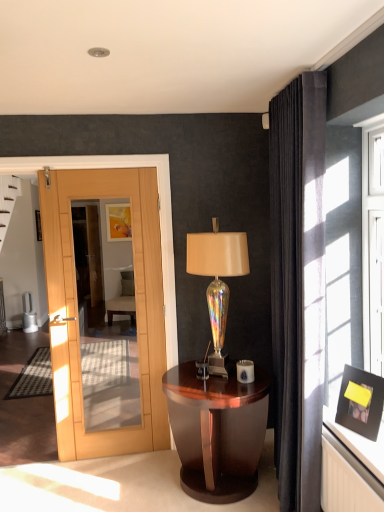
This screenshot has height=512, width=384. What do you see at coordinates (360, 402) in the screenshot?
I see `matte black picture frame at upper right, the second picture frame from the top` at bounding box center [360, 402].

Image resolution: width=384 pixels, height=512 pixels. I want to click on iridescent glass table lamp at center, so click(217, 279).

Based on the photo, is the depth of glossy wood nightstand at center less than that of matte gold picture frame at upper center, the 2th picture frame viewed from the right?

That is True.

Image resolution: width=384 pixels, height=512 pixels. Identify the location of nightstand below the matte gold picture frame at upper center, which is the first picture frame from back to front (from the image's perspective). (217, 431).

From the image's perspective, which one is positioned lower, glossy wood nightstand at center or matte gold picture frame at upper center, which is the first picture frame from back to front?

glossy wood nightstand at center, from the image's perspective.

Considering the relative sizes of glossy wood nightstand at center and matte gold picture frame at upper center, the second picture frame when ordered from front to back, in the image provided, is glossy wood nightstand at center thinner than matte gold picture frame at upper center, the second picture frame when ordered from front to back,?

No, glossy wood nightstand at center is not thinner than matte gold picture frame at upper center, the second picture frame when ordered from front to back.

Is velvet dark gray curtain at right next to glossy wood nightstand at center?

They are not placed beside each other.

Is point (289, 329) less distant than point (263, 410)?

Yes.

Can glossy wood nightstand at center be found inside velvet dark gray curtain at right?

No, glossy wood nightstand at center is not a part of velvet dark gray curtain at right.

Does matte black picture frame at upper right, which is the 1th picture frame in right-to-left order, touch iridescent glass table lamp at center?

matte black picture frame at upper right, which is the 1th picture frame in right-to-left order, is not next to iridescent glass table lamp at center, and they're not touching.

In the scene shown: From a real-world perspective, is matte black picture frame at upper right, the second picture frame from the top, below iridescent glass table lamp at center?

Indeed, from a real-world perspective, matte black picture frame at upper right, the second picture frame from the top, is positioned beneath iridescent glass table lamp at center.

Considering the points (349, 414) and (229, 241), which point is in front, point (349, 414) or point (229, 241)?

Point (349, 414)

Is matte black picture frame at upper right, which appears as the 1th picture frame when viewed from the front, not within iridescent glass table lamp at center?

Yes, matte black picture frame at upper right, which appears as the 1th picture frame when viewed from the front, is outside of iridescent glass table lamp at center.

Does point (346, 374) lie in front of point (290, 465)?

Yes, it is in front of point (290, 465).

Considering the relative sizes of matte black picture frame at upper right, which appears as the 1th picture frame when viewed from the front, and velvet dark gray curtain at right in the image provided, is matte black picture frame at upper right, which appears as the 1th picture frame when viewed from the front, wider than velvet dark gray curtain at right?

No, matte black picture frame at upper right, which appears as the 1th picture frame when viewed from the front, is not wider than velvet dark gray curtain at right.

Is matte gold picture frame at upper center, which is the first picture frame from back to front, oriented away from glossy wood nightstand at center?

No, matte gold picture frame at upper center, which is the first picture frame from back to front,'s orientation is not away from glossy wood nightstand at center.

From a real-world perspective, between matte gold picture frame at upper center, which is the second picture frame in bottom-to-top order, and glossy wood nightstand at center, who is vertically higher?

In real-world perspective, matte gold picture frame at upper center, which is the second picture frame in bottom-to-top order, is above.

Does matte gold picture frame at upper center, the first picture frame when ordered from top to bottom, appear on the right side of glossy wood nightstand at center?

No, matte gold picture frame at upper center, the first picture frame when ordered from top to bottom, is not to the right of glossy wood nightstand at center.

From the image's perspective, is iridescent glass table lamp at center located above velvet dark gray curtain at right?

No, from the image's perspective, iridescent glass table lamp at center is not on top of velvet dark gray curtain at right.

Is point (234, 251) behind point (311, 102)?

Yes.

How different are the orientations of iridescent glass table lamp at center and velvet dark gray curtain at right in degrees?

89.1 degrees separate the facing orientations of iridescent glass table lamp at center and velvet dark gray curtain at right.

Is matte black picture frame at upper right, which is the 1th picture frame in right-to-left order, oriented away from matte gold picture frame at upper center, the second picture frame when ordered from front to back?

matte black picture frame at upper right, which is the 1th picture frame in right-to-left order, does not have its back to matte gold picture frame at upper center, the second picture frame when ordered from front to back.

Would you say matte black picture frame at upper right, which appears as the first picture frame when ordered from the bottom, contains matte gold picture frame at upper center, which is counted as the 1th picture frame, starting from the left?

No, matte gold picture frame at upper center, which is counted as the 1th picture frame, starting from the left, is located outside of matte black picture frame at upper right, which appears as the first picture frame when ordered from the bottom.

Considering the sizes of matte black picture frame at upper right, the second picture frame from the top, and matte gold picture frame at upper center, the 2th picture frame viewed from the right, in the image, is matte black picture frame at upper right, the second picture frame from the top, taller or shorter than matte gold picture frame at upper center, the 2th picture frame viewed from the right,?

Considering their sizes, matte black picture frame at upper right, the second picture frame from the top, has less height than matte gold picture frame at upper center, the 2th picture frame viewed from the right.

Can you confirm if matte black picture frame at upper right, the second picture frame from the top, is positioned to the right of matte gold picture frame at upper center, the 2th picture frame viewed from the right?

Yes, matte black picture frame at upper right, the second picture frame from the top, is to the right of matte gold picture frame at upper center, the 2th picture frame viewed from the right.

Where is `the 2nd picture frame located above the glossy wood nightstand at center (from a real-world perspective)`? the 2nd picture frame located above the glossy wood nightstand at center (from a real-world perspective) is located at coordinates (118, 222).

Where is `curtain that appears in front of the glossy wood nightstand at center`? curtain that appears in front of the glossy wood nightstand at center is located at coordinates (298, 286).

Based on their spatial positions, is glossy wood nightstand at center or velvet dark gray curtain at right closer to iridescent glass table lamp at center?

Based on the image, velvet dark gray curtain at right appears to be nearer to iridescent glass table lamp at center.

From the picture: Estimate the real-world distances between objects in this image. Which object is closer to matte black picture frame at upper right, which appears as the 1th picture frame when viewed from the front, iridescent glass table lamp at center or matte gold picture frame at upper center, which is the first picture frame from back to front?

Based on the image, iridescent glass table lamp at center appears to be nearer to matte black picture frame at upper right, which appears as the 1th picture frame when viewed from the front.

Estimate the real-world distances between objects in this image. Which object is closer to matte gold picture frame at upper center, which is the first picture frame from back to front, glossy wood nightstand at center or iridescent glass table lamp at center?

iridescent glass table lamp at center is positioned closer to the anchor matte gold picture frame at upper center, which is the first picture frame from back to front.

Which object lies further to the anchor point velvet dark gray curtain at right, matte gold picture frame at upper center, the 2th picture frame viewed from the right, or glossy wood nightstand at center?

matte gold picture frame at upper center, the 2th picture frame viewed from the right, lies further to velvet dark gray curtain at right than the other object.

Considering their positions, is velvet dark gray curtain at right positioned further to glossy wood nightstand at center than iridescent glass table lamp at center?

iridescent glass table lamp at center is further to glossy wood nightstand at center.

Based on their spatial positions, is iridescent glass table lamp at center or velvet dark gray curtain at right further from matte gold picture frame at upper center, the second picture frame when ordered from front to back?

Based on the image, velvet dark gray curtain at right appears to be further to matte gold picture frame at upper center, the second picture frame when ordered from front to back.

Based on their spatial positions, is iridescent glass table lamp at center or matte black picture frame at upper right, which is the 1th picture frame in right-to-left order, closer to glossy wood nightstand at center?

matte black picture frame at upper right, which is the 1th picture frame in right-to-left order.

Which object lies further to the anchor point glossy wood nightstand at center, velvet dark gray curtain at right or matte gold picture frame at upper center, the second picture frame when ordered from front to back?

matte gold picture frame at upper center, the second picture frame when ordered from front to back.

Identify the location of table lamp between velvet dark gray curtain at right and glossy wood nightstand at center vertically. (217, 279).

Where is `curtain situated between iridescent glass table lamp at center and matte black picture frame at upper right, the second picture frame from the top, from left to right`? The width and height of the screenshot is (384, 512). curtain situated between iridescent glass table lamp at center and matte black picture frame at upper right, the second picture frame from the top, from left to right is located at coordinates (298, 286).

Where is `curtain between matte black picture frame at upper right, which appears as the first picture frame when ordered from the bottom, and matte gold picture frame at upper center, which is counted as the 1th picture frame, starting from the left, in the front-back direction`? This screenshot has height=512, width=384. curtain between matte black picture frame at upper right, which appears as the first picture frame when ordered from the bottom, and matte gold picture frame at upper center, which is counted as the 1th picture frame, starting from the left, in the front-back direction is located at coordinates (298, 286).

You are a GUI agent. You are given a task and a screenshot of the screen. Output one action in this format:
    pyautogui.click(x=<x>, y=<y>)
    Task: Click on the table lamp positioned between velvet dark gray curtain at right and matte gold picture frame at upper center, which is the second picture frame in bottom-to-top order, from near to far
    
    Given the screenshot: What is the action you would take?
    pyautogui.click(x=217, y=279)